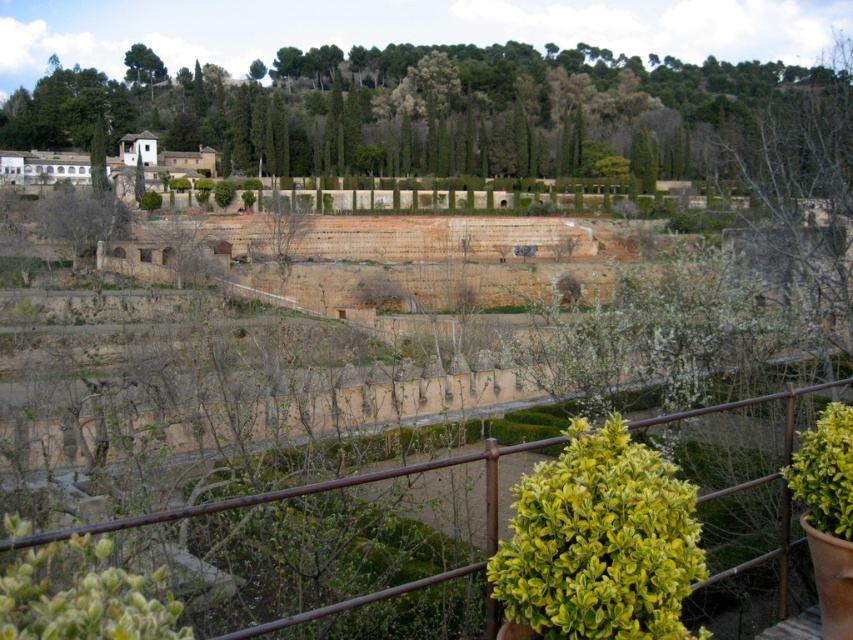
You are standing at the point with coordinates (x=424, y=109) in the historical garden. What can you see directly in front of you?

At point (x=424, y=109) lies green leafy tree at upper center, so you can see the green leafy tree at upper center directly in front of you.